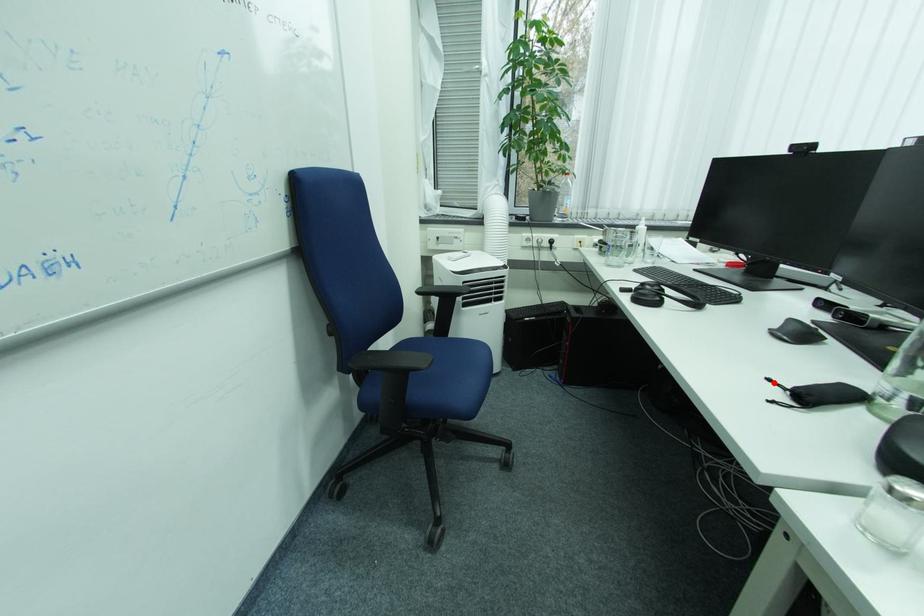
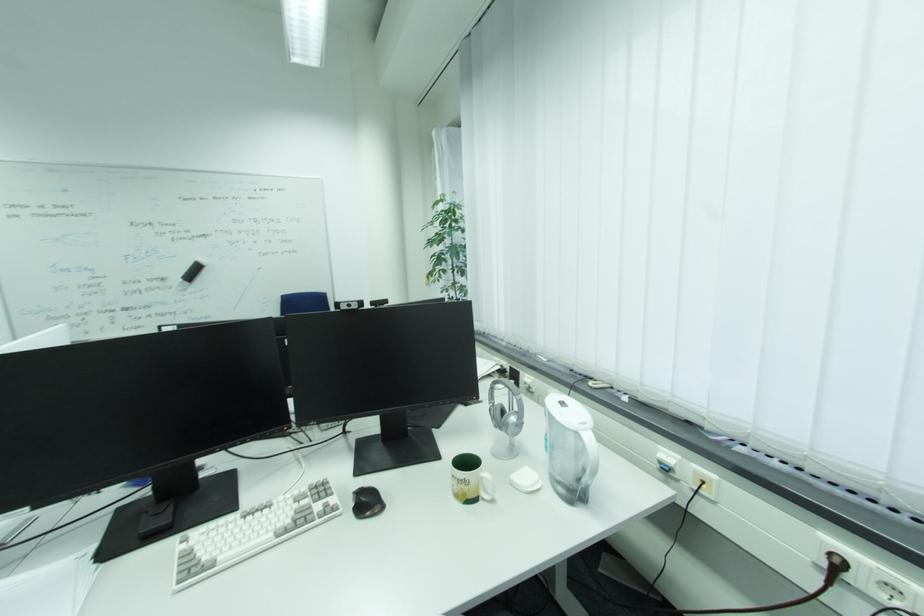
Question: I am providing you with two images of the same scene from different viewpoints. A red point is marked on the first image. Is the red point's position out of view in image 2?

Choices:
 (A) Yes
 (B) No

Answer: (A)